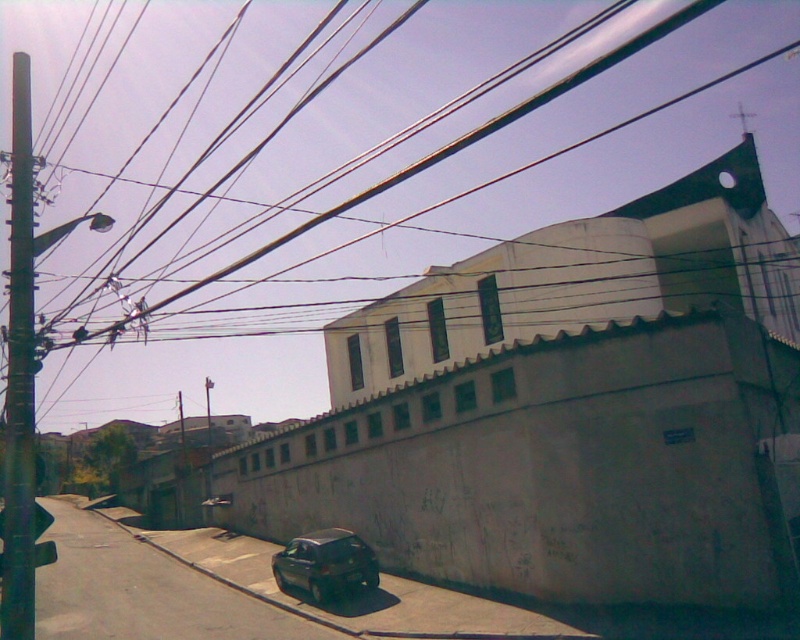
Question: Is metallic gray pole at left further to the viewer compared to dark gray matte car at lower center?

Choices:
 (A) no
 (B) yes

Answer: (A)

Question: Can you confirm if metallic gray pole at left is positioned to the right of dark gray matte car at lower center?

Choices:
 (A) yes
 (B) no

Answer: (B)

Question: Is metallic gray pole at left bigger than dark gray matte car at lower center?

Choices:
 (A) yes
 (B) no

Answer: (A)

Question: Among these objects, which one is farthest from the camera?

Choices:
 (A) dark gray matte car at lower center
 (B) metallic gray pole at left

Answer: (A)